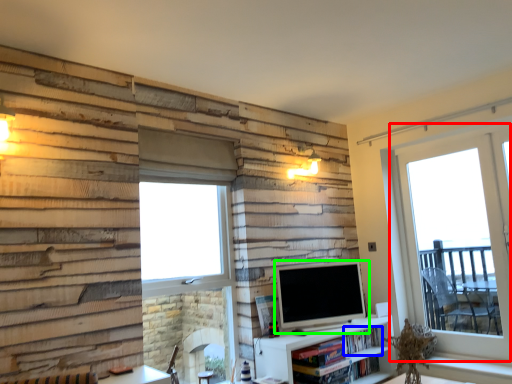
Question: Which object is positioned farthest from window (highlighted by a red box)? Select from book (highlighted by a blue box) and television (highlighted by a green box).

Choices:
 (A) book
 (B) television

Answer: (A)